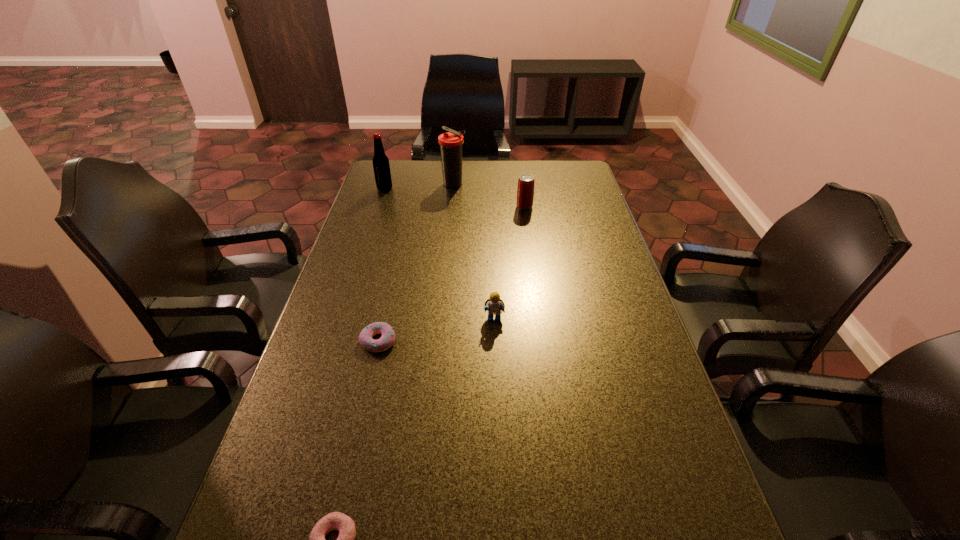
The width and height of the screenshot is (960, 540). Identify the location of thermos bottle. (451, 142).

This screenshot has width=960, height=540. Identify the location of the leftmost object. (381, 166).

Locate an element on the screen. Image resolution: width=960 pixels, height=540 pixels. the fourth nearest object is located at coordinates (525, 192).

The height and width of the screenshot is (540, 960). Find the location of `the rightmost object`. the rightmost object is located at coordinates (525, 192).

You are a GUI agent. You are given a task and a screenshot of the screen. Output one action in this format:
    pyautogui.click(x=<x>, y=<y>)
    Task: Click on the third nearest object
    This screenshot has width=960, height=540.
    Given the screenshot: What is the action you would take?
    pyautogui.click(x=494, y=305)

Find the location of `the third shortest object`. the third shortest object is located at coordinates (494, 305).

Image resolution: width=960 pixels, height=540 pixels. In order to click on the farther doughnut in this screenshot , I will do `click(387, 339)`.

Locate an element on the screen. This screenshot has width=960, height=540. blank area located 0.280m on the left of the thermos bottle is located at coordinates (370, 185).

This screenshot has height=540, width=960. Find the location of `vacant space located on the back of the beer bottle`. vacant space located on the back of the beer bottle is located at coordinates (393, 166).

Image resolution: width=960 pixels, height=540 pixels. In order to click on free location located 0.320m on the front of the fourth nearest object in this screenshot , I will do 533,267.